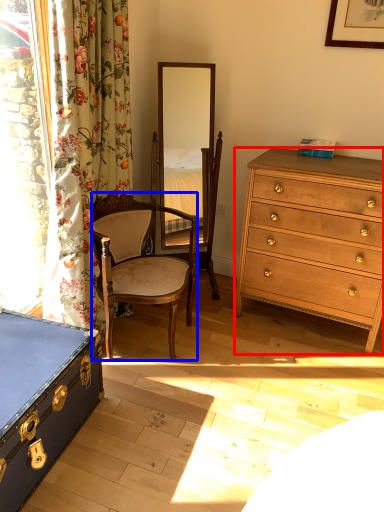
Question: Which point is closer to the camera, chest of drawers (highlighted by a red box) or chair (highlighted by a blue box)?

Choices:
 (A) chest of drawers
 (B) chair

Answer: (B)